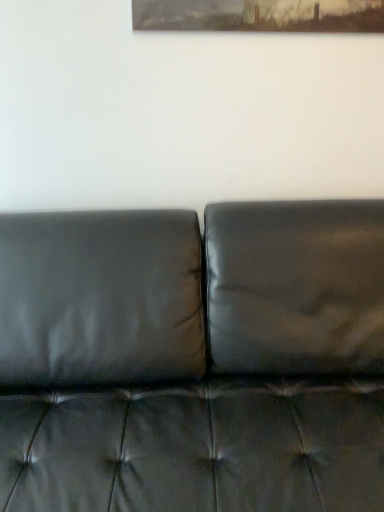
Question: Should I look upward or downward to see black leather couch at center?

Choices:
 (A) up
 (B) down

Answer: (B)